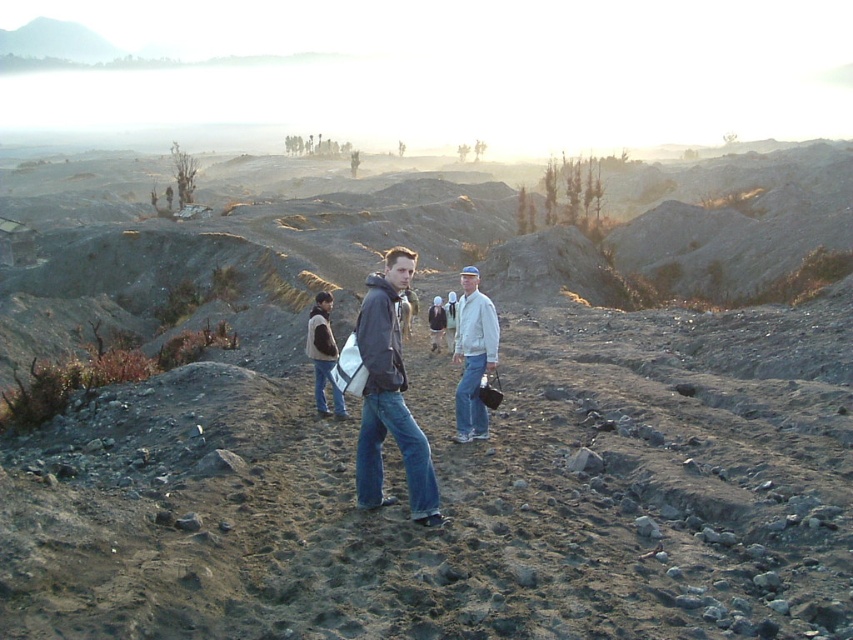
Question: Which of the following is the farthest from the observer?

Choices:
 (A) brown suede vest at center
 (B) matte gray jacket at center
 (C) light gray fabric jacket at center
 (D) white matte jacket at center

Answer: (C)

Question: From the image, what is the correct spatial relationship of white matte jacket at center in relation to light gray fabric jacket at center?

Choices:
 (A) right
 (B) left

Answer: (A)

Question: Is matte gray jacket at center to the left of brown suede vest at center from the viewer's perspective?

Choices:
 (A) yes
 (B) no

Answer: (B)

Question: Among these points, which one is nearest to the camera?

Choices:
 (A) (329, 353)
 (B) (364, 417)

Answer: (B)

Question: Which point is farther from the camera taking this photo?

Choices:
 (A) (473, 371)
 (B) (312, 344)
 (C) (428, 317)

Answer: (C)

Question: Does brown suede vest at center appear over light gray fabric jacket at center?

Choices:
 (A) no
 (B) yes

Answer: (A)